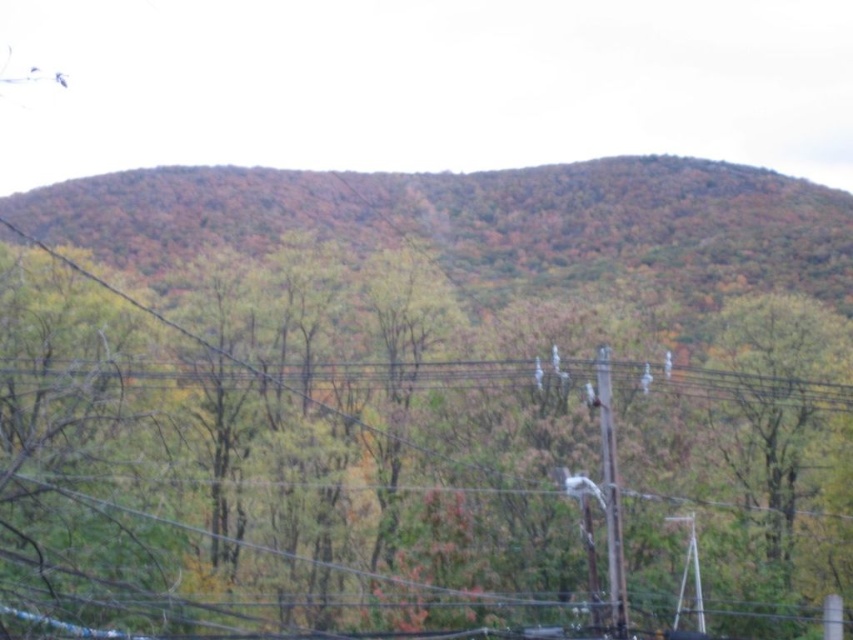
Question: Which of the following is the closest to the observer?

Choices:
 (A) (36, 385)
 (B) (619, 572)

Answer: (B)

Question: Can you confirm if green matte tree at center is positioned to the left of smooth wooden telegraph pole at right?

Choices:
 (A) no
 (B) yes

Answer: (B)

Question: Is green matte tree at center in front of smooth wooden telegraph pole at right?

Choices:
 (A) no
 (B) yes

Answer: (B)

Question: Among these points, which one is farthest from the camera?

Choices:
 (A) (608, 433)
 (B) (714, 461)

Answer: (B)

Question: Which object is farther from the camera taking this photo?

Choices:
 (A) green matte tree at center
 (B) smooth wooden telegraph pole at right

Answer: (B)

Question: Can you confirm if green matte tree at center is thinner than smooth wooden telegraph pole at right?

Choices:
 (A) yes
 (B) no

Answer: (B)